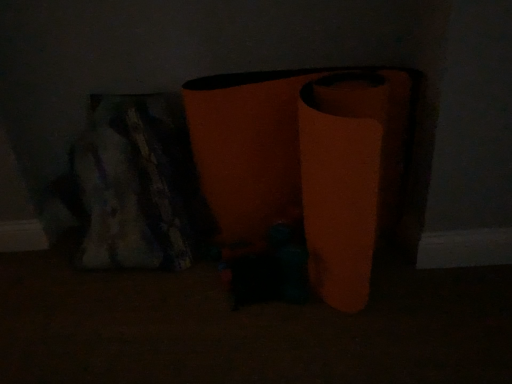
I want to click on orange matte vase at center, so click(304, 164).

Measure the distance between orange matte vase at center and camera.

A distance of 3.37 feet exists between orange matte vase at center and camera.

This screenshot has width=512, height=384. Describe the element at coordinates (304, 164) in the screenshot. I see `orange matte vase at center` at that location.

Where is `orange matte vase at center`? The height and width of the screenshot is (384, 512). orange matte vase at center is located at coordinates (304, 164).